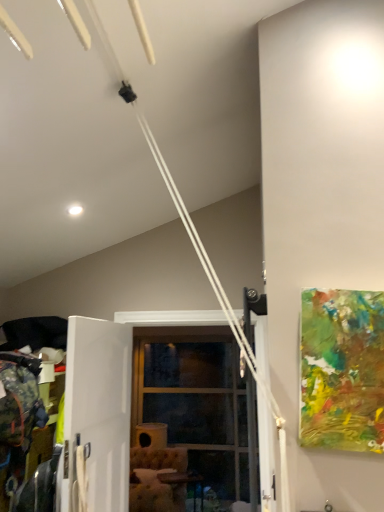
Question: Is clear glass door at center at the back of abstract painting at right?

Choices:
 (A) yes
 (B) no

Answer: (B)

Question: Does abstract painting at right have a greater height compared to clear glass door at center?

Choices:
 (A) yes
 (B) no

Answer: (B)

Question: Is clear glass door at center surrounded by abstract painting at right?

Choices:
 (A) yes
 (B) no

Answer: (B)

Question: Can you confirm if abstract painting at right is bigger than clear glass door at center?

Choices:
 (A) no
 (B) yes

Answer: (A)

Question: Are abstract painting at right and clear glass door at center making contact?

Choices:
 (A) no
 (B) yes

Answer: (A)

Question: Is abstract painting at right far away from clear glass door at center?

Choices:
 (A) no
 (B) yes

Answer: (B)

Question: Considering the relative sizes of abstract painting at right and white matte screen door at center in the image provided, is abstract painting at right wider than white matte screen door at center?

Choices:
 (A) no
 (B) yes

Answer: (B)

Question: Is abstract painting at right thinner than white matte screen door at center?

Choices:
 (A) no
 (B) yes

Answer: (A)

Question: Is abstract painting at right aimed at white matte screen door at center?

Choices:
 (A) yes
 (B) no

Answer: (B)

Question: From a real-world perspective, is abstract painting at right on white matte screen door at center?

Choices:
 (A) yes
 (B) no

Answer: (A)

Question: From a real-world perspective, is abstract painting at right located beneath white matte screen door at center?

Choices:
 (A) no
 (B) yes

Answer: (A)

Question: Is abstract painting at right taller than white matte screen door at center?

Choices:
 (A) no
 (B) yes

Answer: (A)

Question: Are clear glass door at center and wooden table at lower center located far from each other?

Choices:
 (A) yes
 (B) no

Answer: (B)